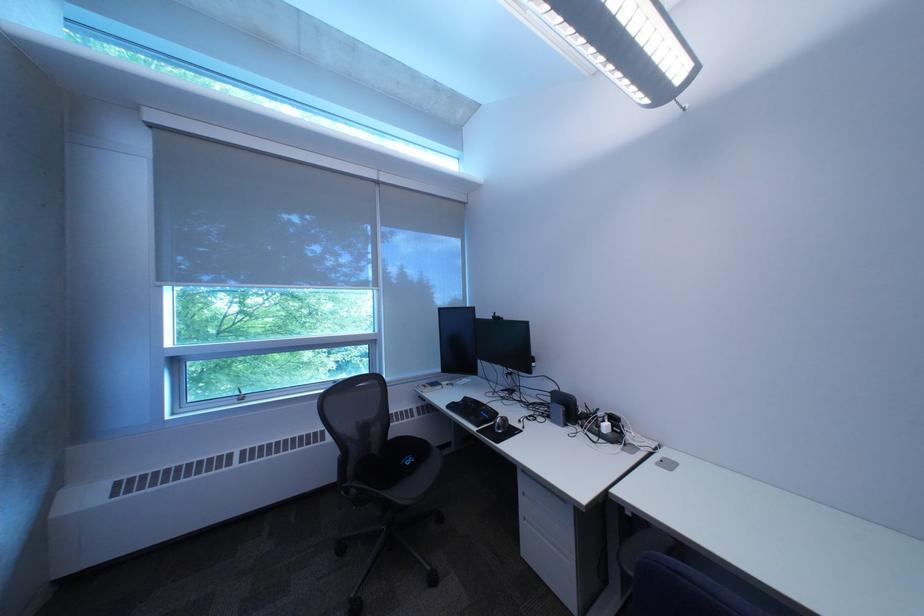
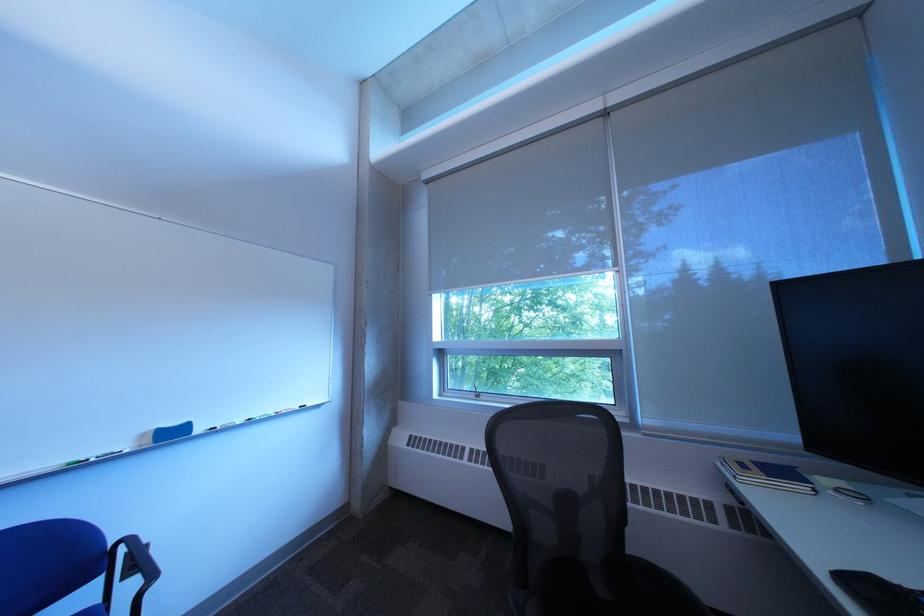
Question: The images are taken continuously from a first-person perspective. In which direction is your viewpoint rotating?

Choices:
 (A) Left
 (B) Right
 (C) Up
 (D) Down

Answer: (A)